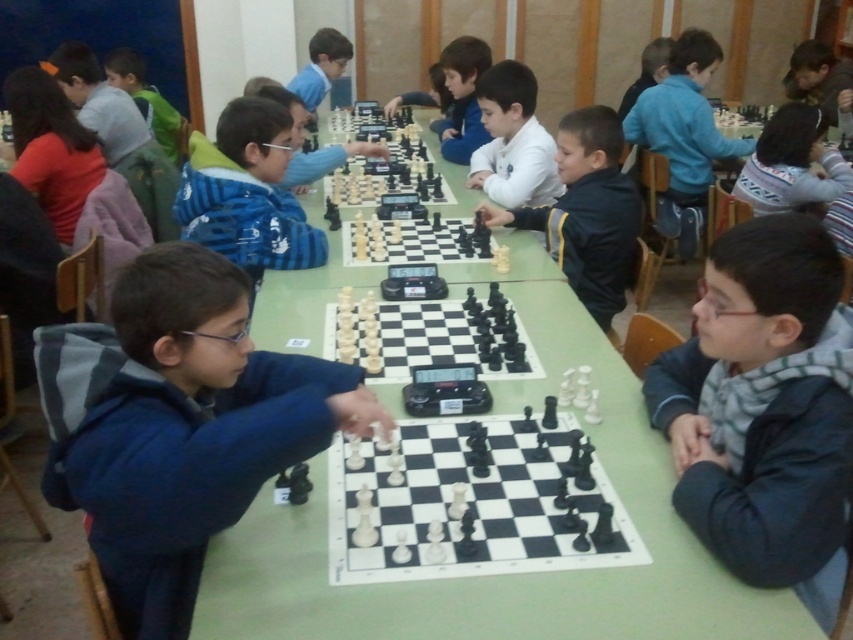
Looking at this image, you are a photographer standing at the back of the room. You want to take a photo of the chess tournament. You notice two points marked in the image. Which point, point (582, 520) or point (619, 131), is closer to you?

Point (582, 520) is closer to the viewer than point (619, 131).